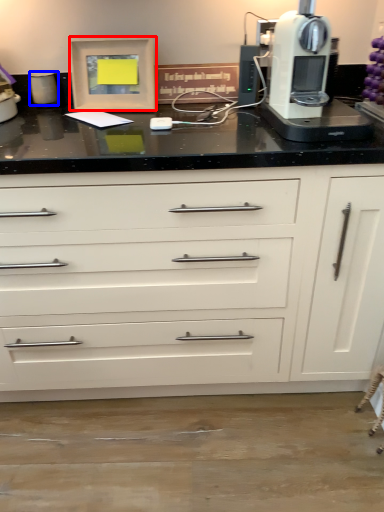
Question: Which object appears closest to the camera in this image, picture frame (highlighted by a red box) or kitchen appliance (highlighted by a blue box)?

Choices:
 (A) picture frame
 (B) kitchen appliance

Answer: (A)